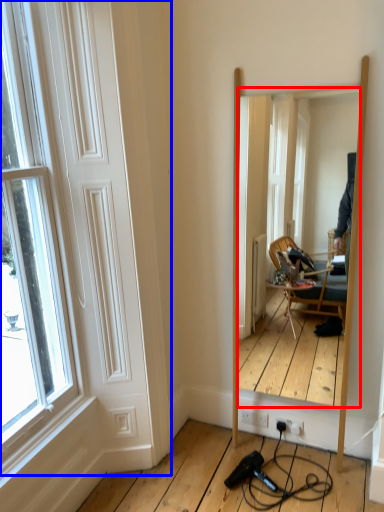
Question: Which point is further to the camera, mirror (highlighted by a red box) or door (highlighted by a blue box)?

Choices:
 (A) mirror
 (B) door

Answer: (A)